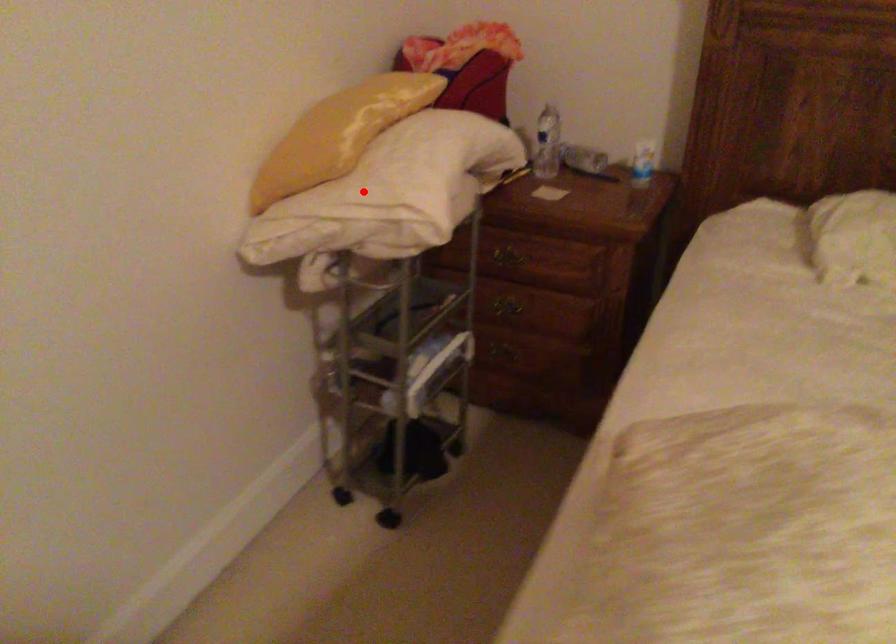
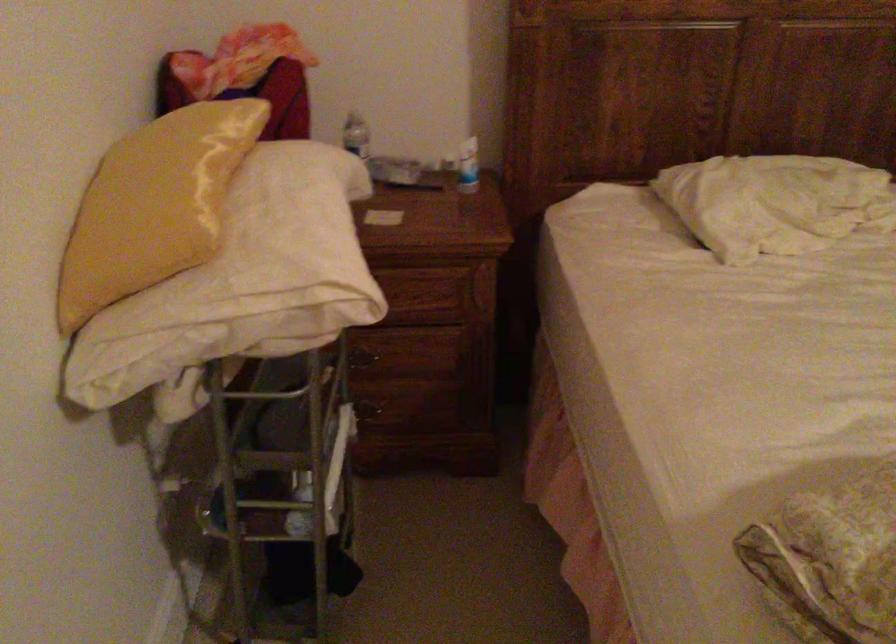
Where in the second image is the point corresponding to the highlighted location from the first image?

(254, 272)